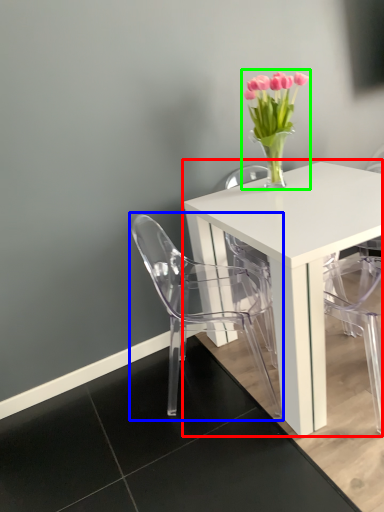
Question: Which object is the farthest from table (highlighted by a red box)? Choose among these: chair (highlighted by a blue box) or floral arrangement (highlighted by a green box).

Choices:
 (A) chair
 (B) floral arrangement

Answer: (B)